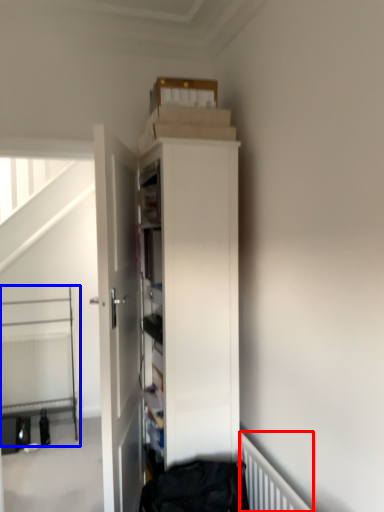
Question: Which object is closer to the camera taking this photo, radiator (highlighted by a red box) or bed (highlighted by a blue box)?

Choices:
 (A) radiator
 (B) bed

Answer: (A)